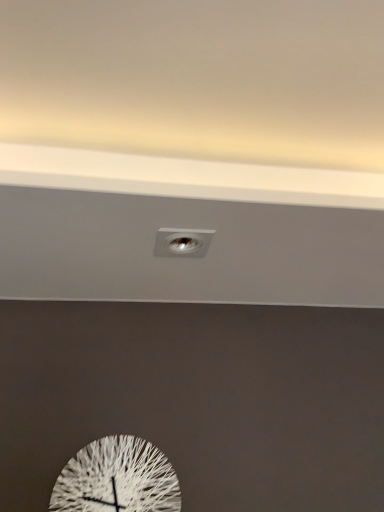
Question: Is metallic silver light fixture at center oriented away from white textured clock at center?

Choices:
 (A) yes
 (B) no

Answer: (B)

Question: Can you confirm if metallic silver light fixture at center is smaller than white textured clock at center?

Choices:
 (A) yes
 (B) no

Answer: (A)

Question: From the image's perspective, is metallic silver light fixture at center under white textured clock at center?

Choices:
 (A) yes
 (B) no

Answer: (B)

Question: Considering the relative sizes of metallic silver light fixture at center and white textured clock at center in the image provided, is metallic silver light fixture at center wider than white textured clock at center?

Choices:
 (A) no
 (B) yes

Answer: (B)

Question: From the image's perspective, would you say metallic silver light fixture at center is positioned over white textured clock at center?

Choices:
 (A) no
 (B) yes

Answer: (B)

Question: Is metallic silver light fixture at center bigger than white textured clock at center?

Choices:
 (A) no
 (B) yes

Answer: (A)

Question: Are white textured clock at center and metallic silver light fixture at center far apart?

Choices:
 (A) no
 (B) yes

Answer: (A)

Question: Can you confirm if white textured clock at center is positioned to the left of metallic silver light fixture at center?

Choices:
 (A) no
 (B) yes

Answer: (B)

Question: Is white textured clock at center looking in the opposite direction of metallic silver light fixture at center?

Choices:
 (A) no
 (B) yes

Answer: (A)

Question: Is the surface of white textured clock at center in direct contact with metallic silver light fixture at center?

Choices:
 (A) yes
 (B) no

Answer: (B)

Question: From the image's perspective, is white textured clock at center located above metallic silver light fixture at center?

Choices:
 (A) yes
 (B) no

Answer: (B)

Question: Can you confirm if white textured clock at center is wider than metallic silver light fixture at center?

Choices:
 (A) yes
 (B) no

Answer: (B)

Question: Relative to white textured clock at center, is metallic silver light fixture at center in front or behind?

Choices:
 (A) front
 (B) behind

Answer: (A)